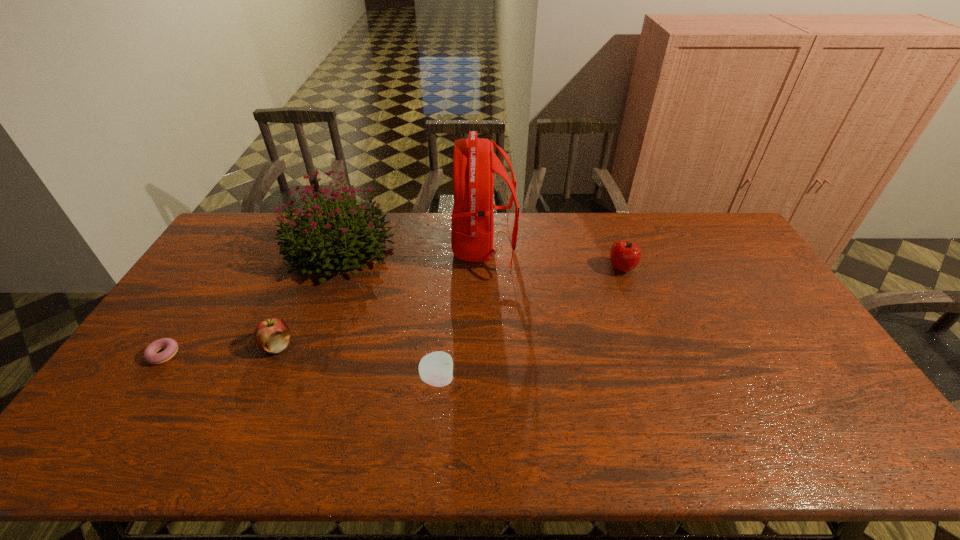
You are a GUI agent. You are given a task and a screenshot of the screen. Output one action in this format:
    pyautogui.click(x=<x>, y=<y>)
    Task: Click on the tallest object
    
    Given the screenshot: What is the action you would take?
    pyautogui.click(x=474, y=162)

Where is `the fifth shortest object`? Image resolution: width=960 pixels, height=540 pixels. the fifth shortest object is located at coordinates (309, 244).

Where is `the tallest apple`? the tallest apple is located at coordinates (624, 256).

Locate an element on the screen. This screenshot has height=540, width=960. the farthest apple is located at coordinates (624, 256).

In order to click on the leftmost apple in this screenshot , I will do `click(272, 335)`.

The height and width of the screenshot is (540, 960). What are the coordinates of `the nearest apple` in the screenshot? It's located at (436, 368).

What are the coordinates of `doughnut` in the screenshot? It's located at (150, 355).

Find the location of a particular element. This screenshot has height=540, width=960. the leftmost object is located at coordinates (150, 355).

Where is `free region located 0.320m on the main compartment of the tallest object`? This screenshot has width=960, height=540. free region located 0.320m on the main compartment of the tallest object is located at coordinates (363, 247).

Identify the location of vacant space located 0.300m on the main compartment of the tallest object. The width and height of the screenshot is (960, 540). (369, 247).